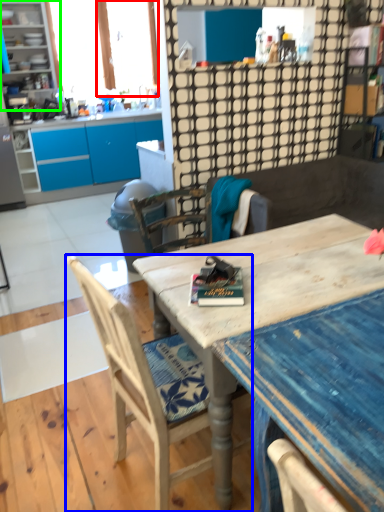
Question: Which object is the closest to the window screen (highlighted by a red box)? Choose among these: chair (highlighted by a blue box) or cabinetry (highlighted by a green box).

Choices:
 (A) chair
 (B) cabinetry

Answer: (B)